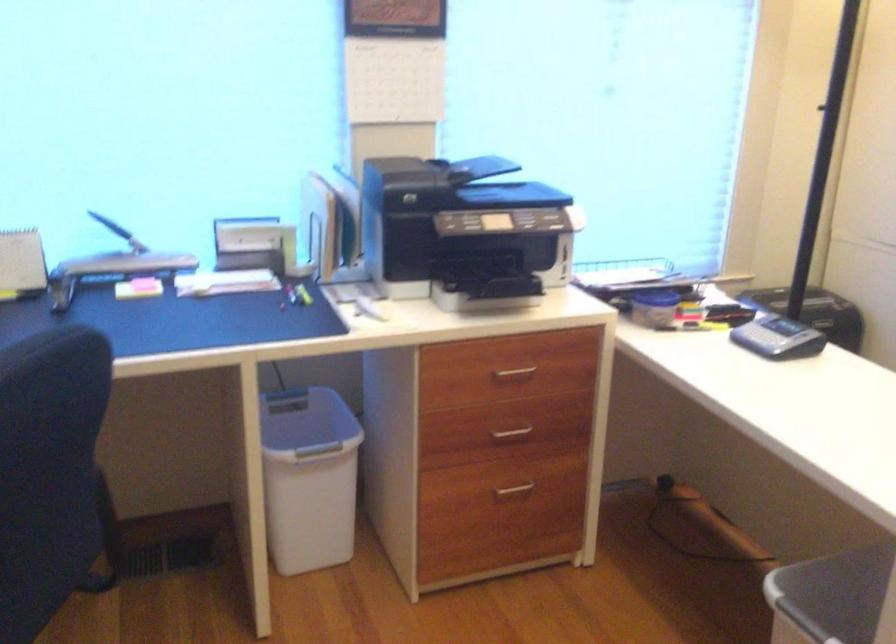
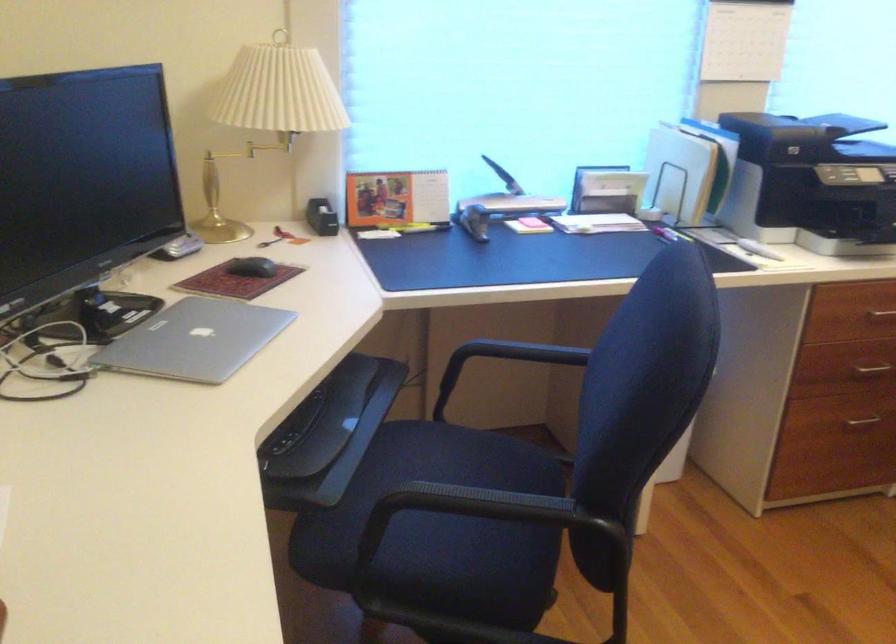
The point at (513, 433) is marked in the first image. Where is the corresponding point in the second image?

(869, 370)